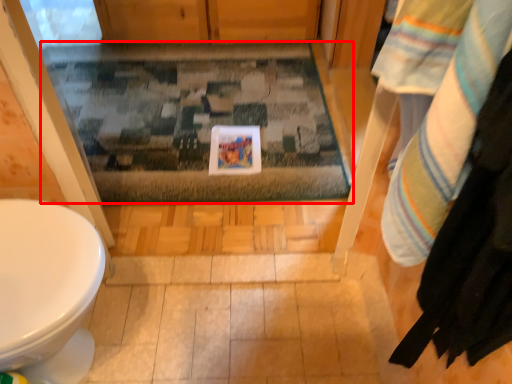
Question: In this image, where is bath mat (annotated by the red box) located relative to laundry?

Choices:
 (A) left
 (B) right

Answer: (A)